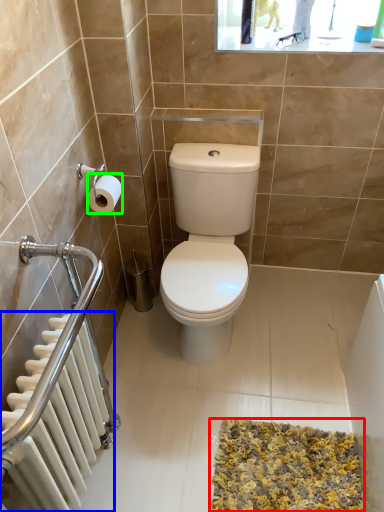
Question: Which is farther away from bath mat (highlighted by a red box)? radiator (highlighted by a blue box) or toilet paper (highlighted by a green box)?

Choices:
 (A) radiator
 (B) toilet paper

Answer: (B)